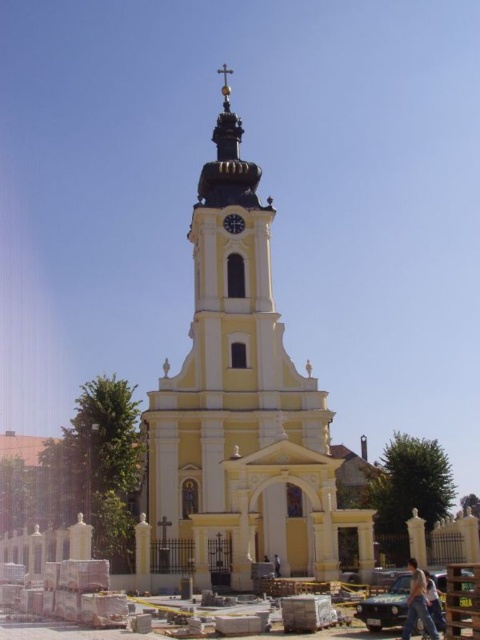
You are standing at point (276, 572) and want to walk towards the church bell tower. Is the point (275, 310) in your path?

Yes, the point (275, 310) is behind point (276, 572), so it is in your path towards the church bell tower.

You are standing at the center of the image. Which direction should you move to reach the light blue jeans at lower right?

You should move towards the lower right direction to reach the light blue jeans at lower right since their position is at point (x=433, y=604).